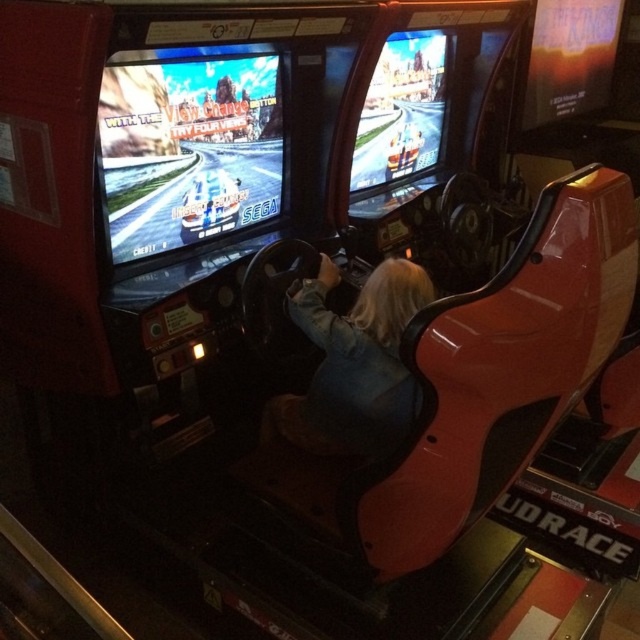
Is shiny plastic screen at center below denim jacket at center?

No, shiny plastic screen at center is not below denim jacket at center.

Who is shorter, shiny plastic screen at center or denim jacket at center?

Standing shorter between the two is denim jacket at center.

Between point (108, 173) and point (401, 403), which one is positioned in front?

Positioned in front is point (108, 173).

Locate an element on the screen. This screenshot has width=640, height=640. shiny plastic screen at center is located at coordinates (188, 150).